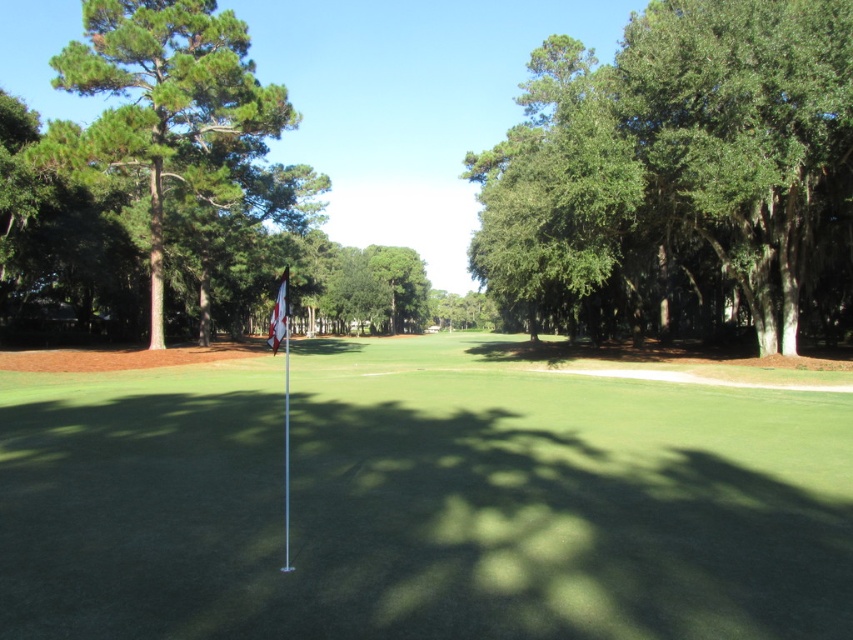
Who is more distant from viewer, (602, 204) or (285, 316)?

The point (602, 204) is behind.

How much distance is there between green leafy tree at right and white fabric flag at center?

green leafy tree at right is 22.92 meters away from white fabric flag at center.

Does point (599, 237) come closer to viewer compared to point (279, 308)?

That is False.

This screenshot has height=640, width=853. Identify the location of green leafy tree at right. (682, 163).

Is green textured tree at left above white fabric flag at center?

Yes, green textured tree at left is above white fabric flag at center.

Measure the distance between green textured tree at left and camera.

green textured tree at left is 27.78 meters away from camera.

Is point (119, 161) positioned behind point (270, 320)?

No, it is in front of (270, 320).

Where is `green textured tree at left`? The width and height of the screenshot is (853, 640). green textured tree at left is located at coordinates (177, 115).

Is point (614, 298) farther from viewer compared to point (56, 56)?

No, it is in front of (56, 56).

Identify the location of green leafy tree at right. This screenshot has width=853, height=640. (682, 163).